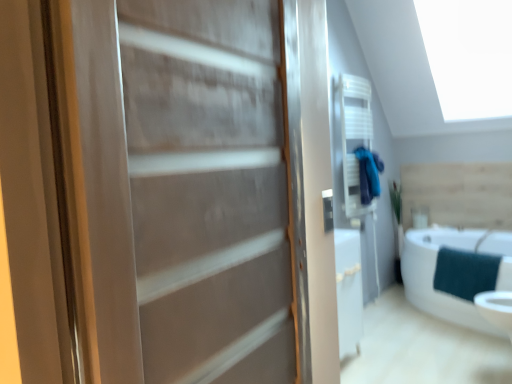
Where is `vacant region above teal fabric towel at lower right (from a real-world perspective)`? vacant region above teal fabric towel at lower right (from a real-world perspective) is located at coordinates (474, 246).